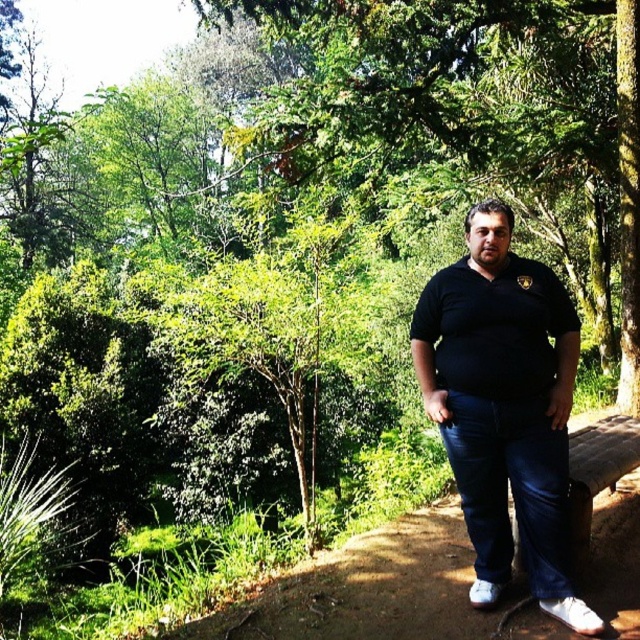
Question: Does brown dirt path at center have a greater width compared to black matte polo shirt at center?

Choices:
 (A) no
 (B) yes

Answer: (B)

Question: Is brown dirt path at center further to camera compared to black matte polo shirt at center?

Choices:
 (A) no
 (B) yes

Answer: (A)

Question: Is black matte shirt at center in front of black matte polo shirt at center?

Choices:
 (A) yes
 (B) no

Answer: (A)

Question: Which object is closer to the camera taking this photo?

Choices:
 (A) black matte shirt at center
 (B) black matte polo shirt at center
 (C) brown dirt path at center

Answer: (A)

Question: Based on their relative distances, which object is farther from the brown dirt path at center?

Choices:
 (A) black matte shirt at center
 (B) black matte polo shirt at center

Answer: (B)

Question: Which object is the farthest from the brown dirt path at center?

Choices:
 (A) black matte shirt at center
 (B) black matte polo shirt at center

Answer: (B)